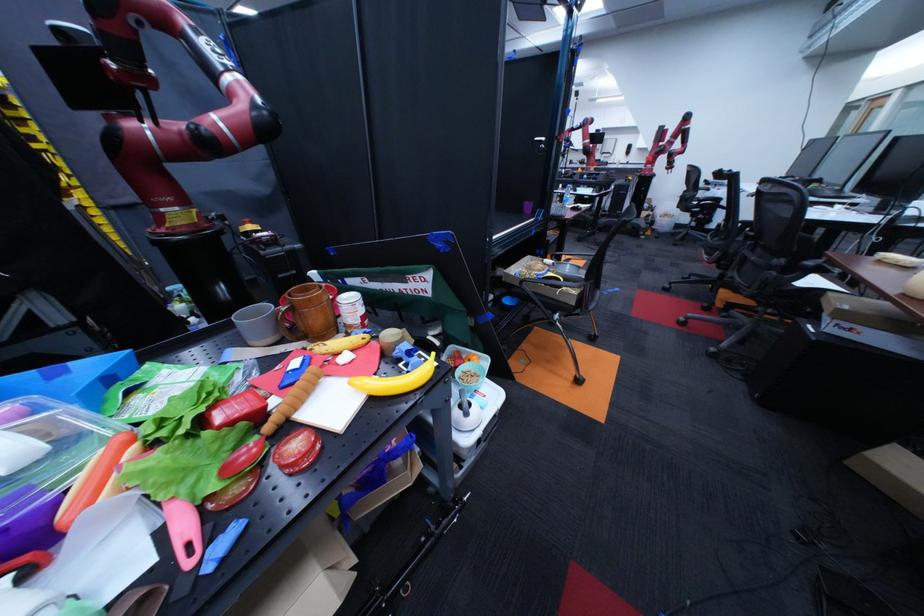
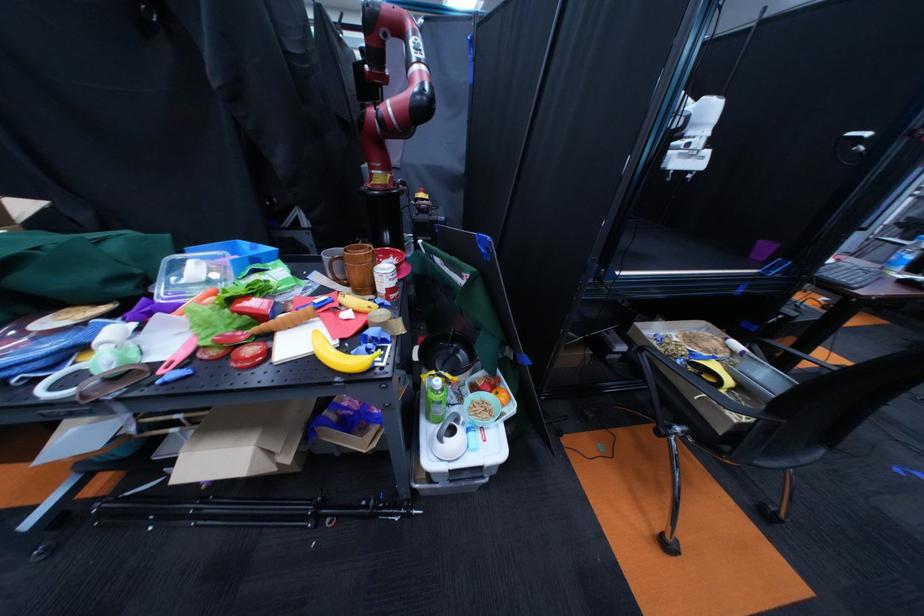
Where in the second image is the point corresponding to (605,341) from the first image?

(776, 517)